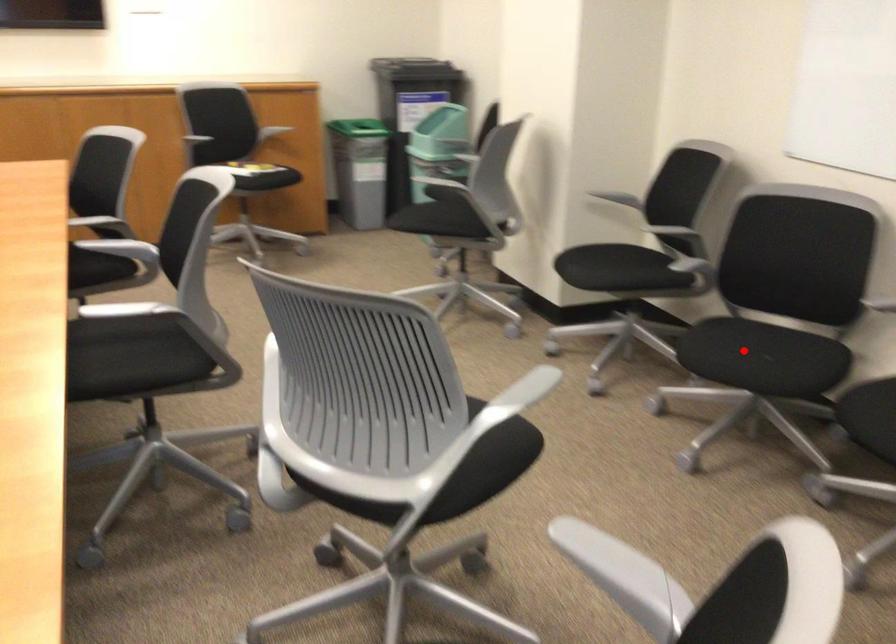
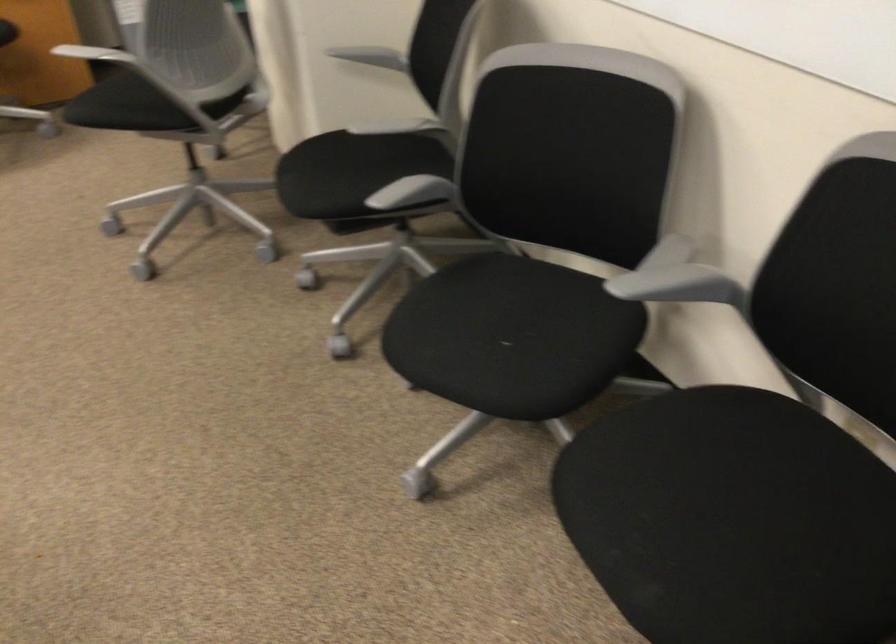
In the second image, find the point that corresponds to the highlighted location in the first image.

(494, 337)